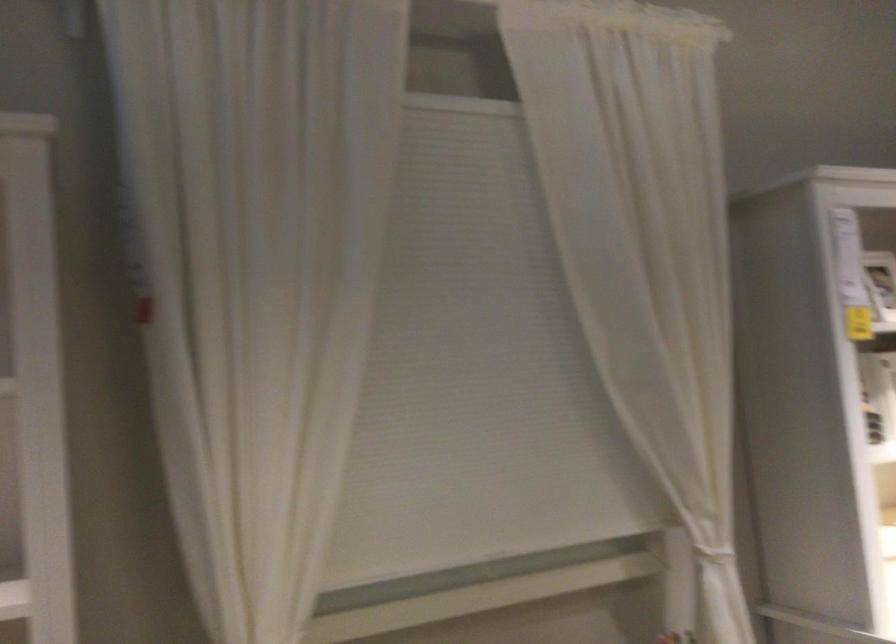
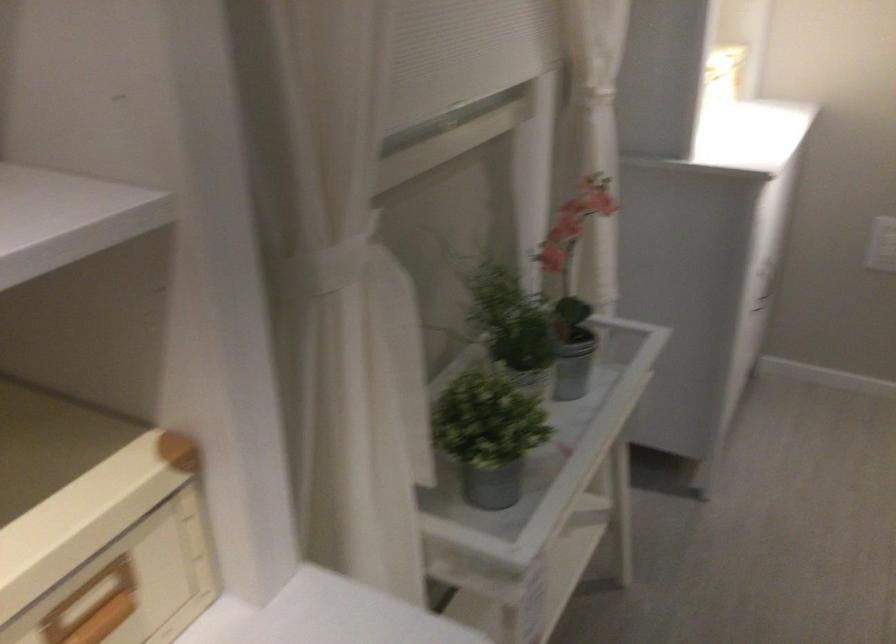
The images are taken continuously from a first-person perspective. In which direction is your viewpoint rotating?

The rotation direction of the camera is right-down.